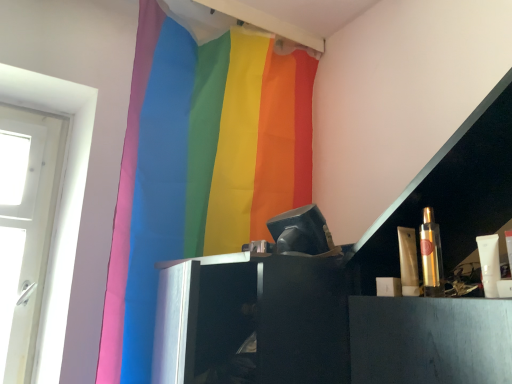
The image size is (512, 384). Identify the location of free space above rainbow fabric curtain at upper center (from a real-world perspective). (224, 23).